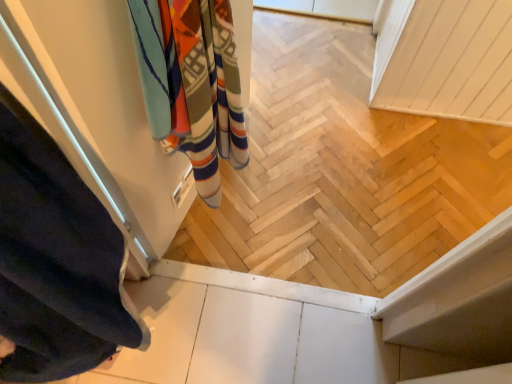
The width and height of the screenshot is (512, 384). I want to click on vacant area situated below dark blue fabric at left (from a real-world perspective), so click(x=152, y=337).